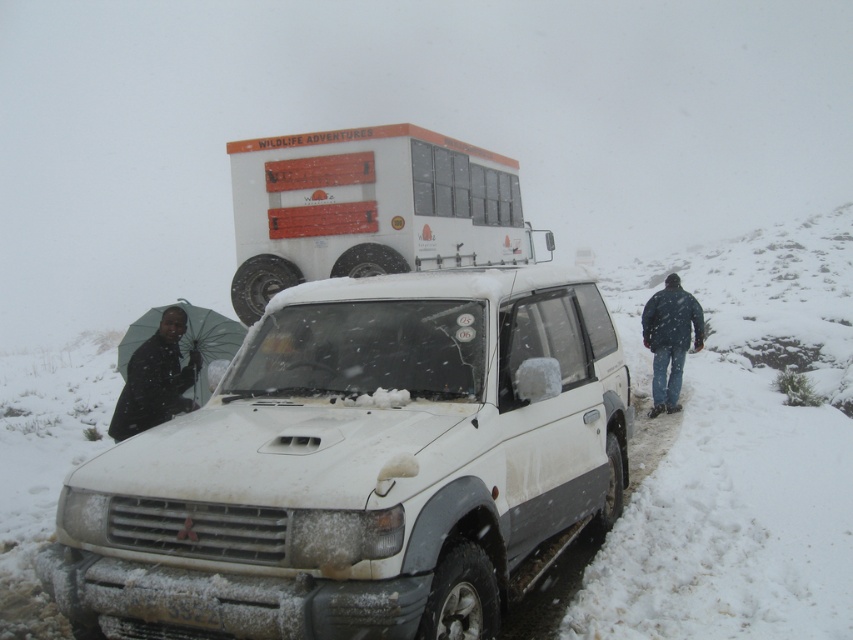
You are standing at the point marked by the coordinates (360,467) in the snowy scene. What object are you directly in front of?

The point marked by the coordinates (360,467) corresponds to the white matte SUV at center, so you are directly in front of the white matte SUV at center.

You are a delivery person needing to place a package between the white matte bus at upper center and the black umbrella at left. The package requires a space of 5 meters. Is the distance sufficient?

The distance between the white matte bus at upper center and the black umbrella at left is 4.62 meters, which is less than the required 5 meters. Therefore, the space is insufficient for placing the package.

You are standing in front of the white Mitsubishi SUV and want to take a photo of the two points marked in the scene. Which point, point [285,612] or point [468,170], is closer to you?

Point [285,612] is closer to the camera than point [468,170], so it is closer to you.